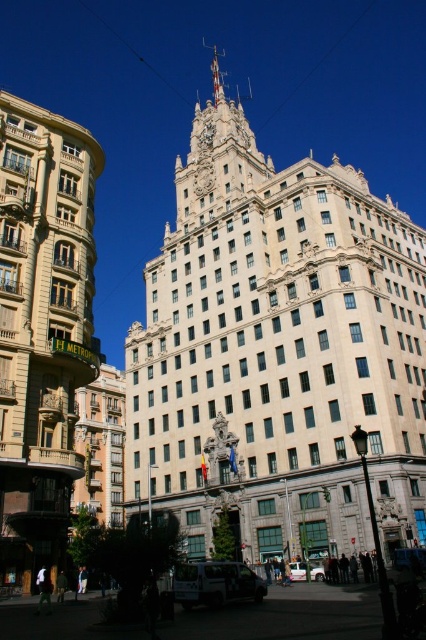
Between point (405, 410) and point (29, 493), which one is positioned in front?

Point (29, 493) is in front.

Locate an element on the screen. This screenshot has width=426, height=640. white stone building at center is located at coordinates (278, 353).